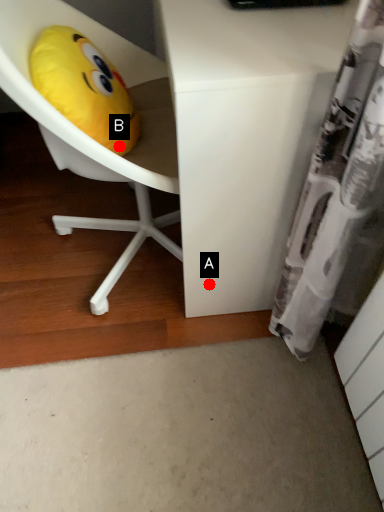
Question: Two points are circled on the image, labeled by A and B beside each circle. Which point is closer to the camera?

Choices:
 (A) A is closer
 (B) B is closer

Answer: (B)